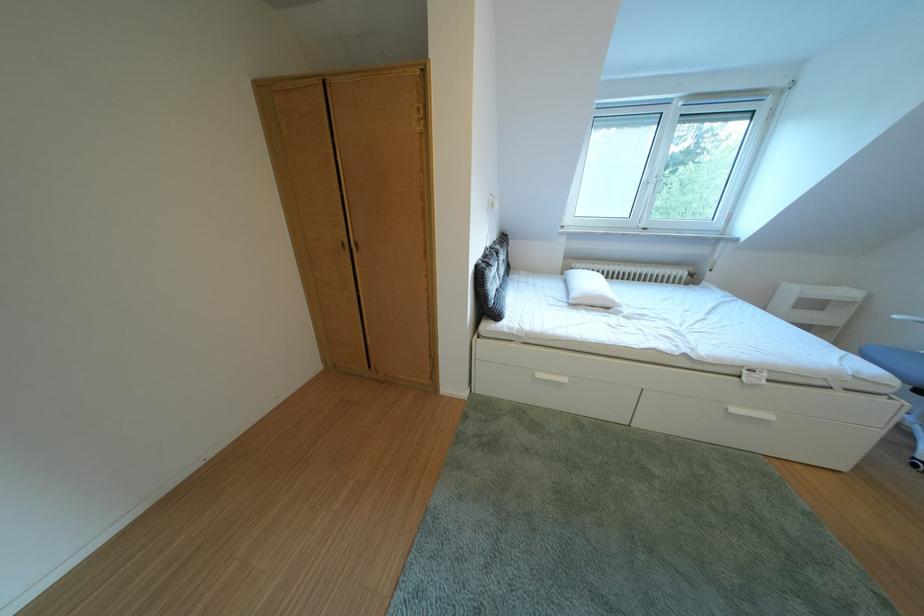
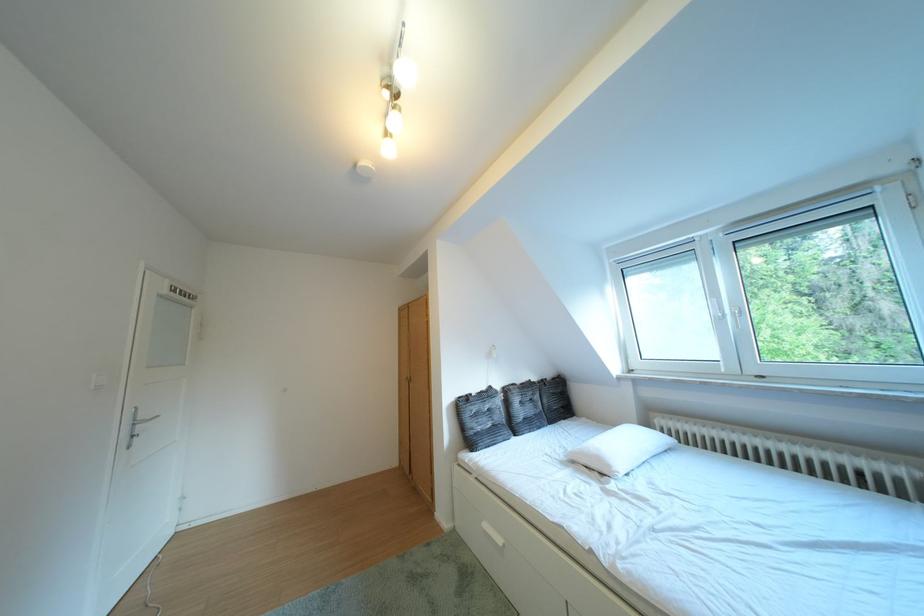
The point at (626, 306) is marked in the first image. Where is the corresponding point in the second image?

(623, 471)